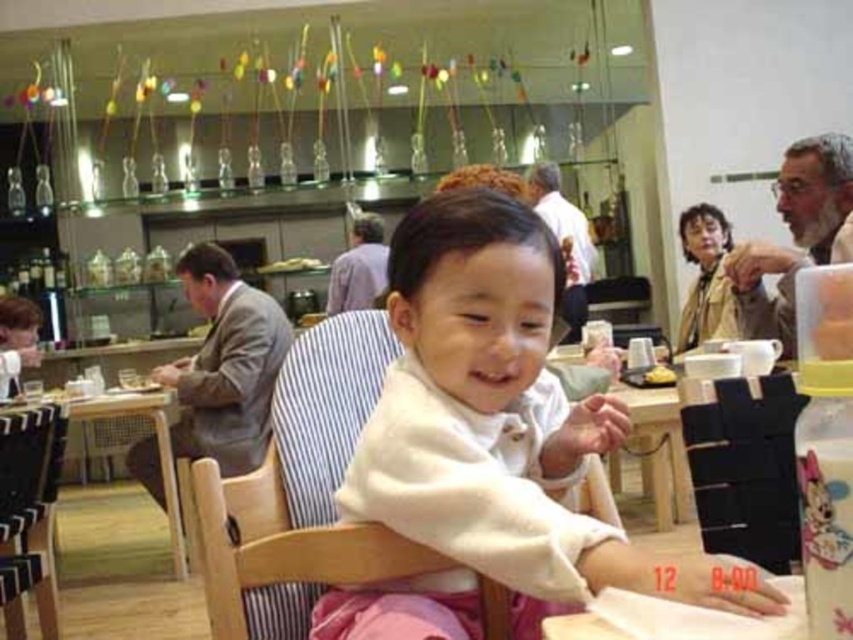
You are a photographer setting up for a group photo. You need to ensure that the wooden chair at center and the white shirt at upper center are both in frame. Given that the camera can only capture objects up to the width of the wider object, will both fit within the camera frame?

The wooden chair at center is narrower than the white shirt at upper center, so the camera frame can accommodate both since it can capture up to the width of the wider object, which is the white shirt at upper center.

Based on the photo, you are a photographer adjusting your camera settings to capture the scene. You notice a point marked at coordinates (x=706, y=278). What object is located at this specific coordinate in the image?

The point at coordinates (x=706, y=278) corresponds to the matte beige sweater at upper right.

You are a photographer taking a picture of the scene. You notice the matte beige sweater at upper right and the white shirt at upper center. Which object is positioned more towards the right side of the image?

The matte beige sweater at upper right is positioned more towards the right side of the image compared to the white shirt at upper center.